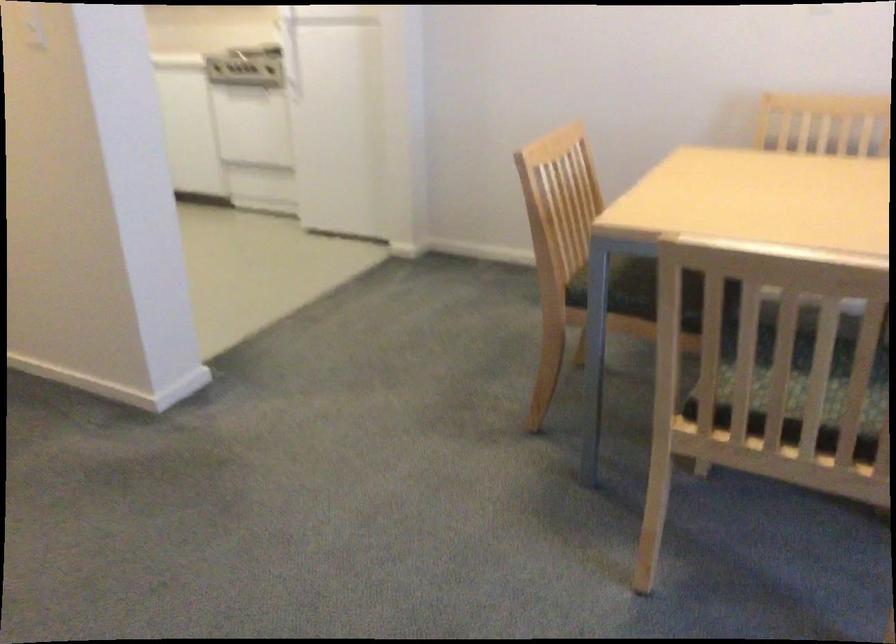
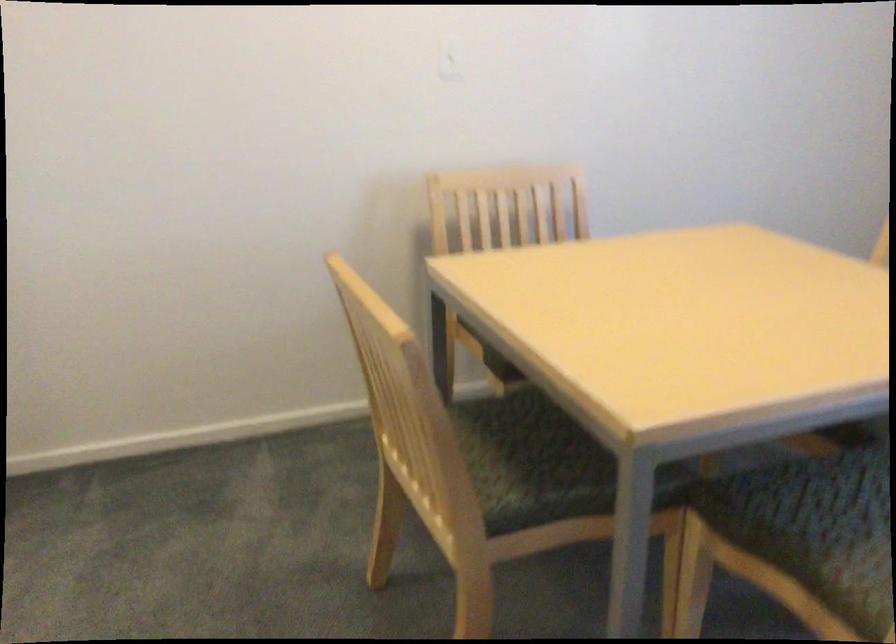
Locate, in the second image, the point that corresponds to pixel 631 277 in the first image.

(530, 462)